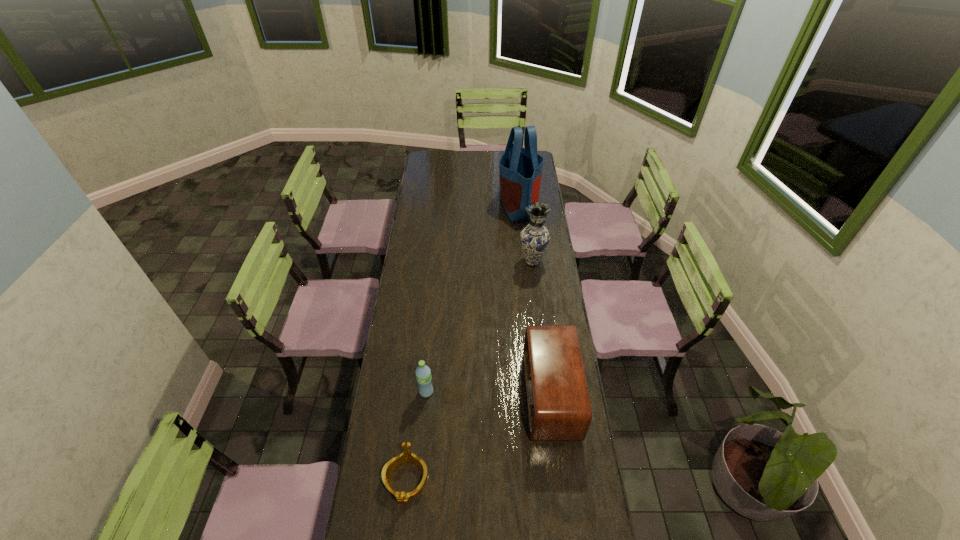
This screenshot has height=540, width=960. In the image, there is a desktop. In order to click on vacant space at the far edge in this screenshot , I will do `click(455, 163)`.

The image size is (960, 540). Find the location of `vacant space at the left edge of the desktop`. vacant space at the left edge of the desktop is located at coordinates (410, 518).

Where is `vacant space at the right edge`? The width and height of the screenshot is (960, 540). vacant space at the right edge is located at coordinates (538, 292).

The width and height of the screenshot is (960, 540). In the image, there is a desktop. What are the coordinates of `free region at the far left corner` in the screenshot? It's located at (446, 161).

Where is `free area in between the nearest object and the radio receiver`? The height and width of the screenshot is (540, 960). free area in between the nearest object and the radio receiver is located at coordinates (478, 437).

Where is `free space between the handbag and the nearest object`? Image resolution: width=960 pixels, height=540 pixels. free space between the handbag and the nearest object is located at coordinates (462, 342).

Identify the location of vacant space in between the radio receiver and the farthest object. Image resolution: width=960 pixels, height=540 pixels. (535, 300).

I want to click on vacant area that lies between the tiara and the vase, so click(469, 370).

I want to click on empty space between the radio receiver and the handbag, so click(x=535, y=300).

The height and width of the screenshot is (540, 960). Find the location of `free spot between the water bottle and the radio receiver`. free spot between the water bottle and the radio receiver is located at coordinates (489, 393).